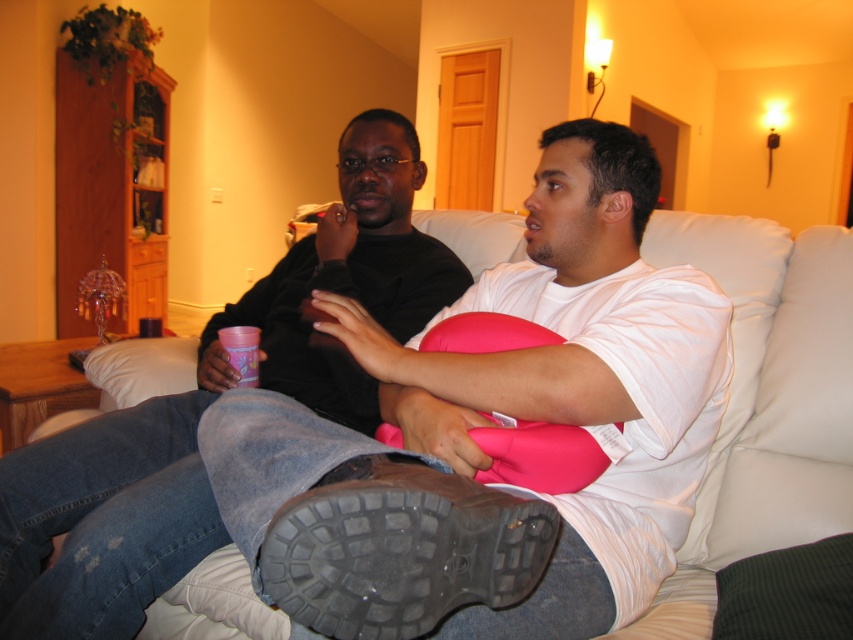
Is point (430, 316) positioned after point (813, 346)?

Yes, it is.

Is matte black shirt at center smaller than white leather couch at center?

Actually, matte black shirt at center might be larger than white leather couch at center.

Which is in front, point (219, 326) or point (735, 397)?

Point (735, 397) is more forward.

I want to click on matte black shirt at center, so click(x=210, y=403).